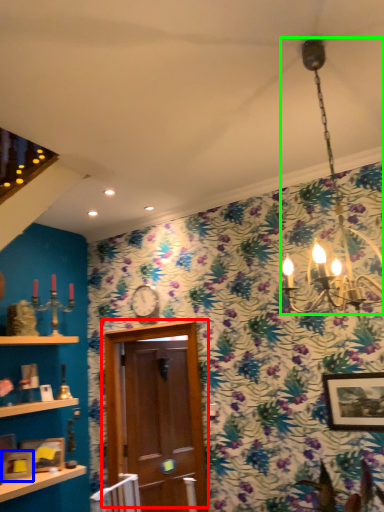
Question: Considering the real-world distances, which object is farthest from door (highlighted by a red box)? picture frame (highlighted by a blue box) or lamp (highlighted by a green box)?

Choices:
 (A) picture frame
 (B) lamp

Answer: (B)